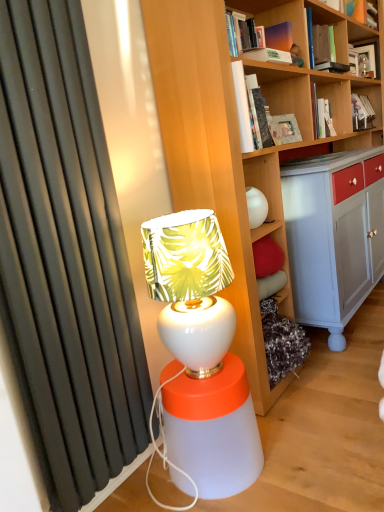
Question: From the image's perspective, is matte orange book at upper right, which ranks as the third book in back-to-front order, under white glossy table lamp at center?

Choices:
 (A) yes
 (B) no

Answer: (B)

Question: Is matte orange book at upper right, acting as the 6th book starting from the bottom, shorter than white glossy table lamp at center?

Choices:
 (A) yes
 (B) no

Answer: (A)

Question: Is matte orange book at upper right, the first book positioned from the top, further to the viewer compared to white glossy table lamp at center?

Choices:
 (A) no
 (B) yes

Answer: (B)

Question: Does matte orange book at upper right, which ranks as the third book in back-to-front order, have a smaller size compared to white glossy table lamp at center?

Choices:
 (A) yes
 (B) no

Answer: (A)

Question: Is matte orange book at upper right, arranged as the fourth book when viewed from the front, turned away from white glossy table lamp at center?

Choices:
 (A) no
 (B) yes

Answer: (A)

Question: From the image's perspective, is matte orange book at upper right, acting as the 6th book starting from the bottom, positioned above or below matte black frame at upper right, positioned as the fifth book in bottom-to-top order?

Choices:
 (A) below
 (B) above

Answer: (B)

Question: Choose the correct answer: Is matte orange book at upper right, which ranks as the third book in back-to-front order, inside matte black frame at upper right, marked as the 1th book in a back-to-front arrangement, or outside it?

Choices:
 (A) inside
 (B) outside

Answer: (B)

Question: Would you say matte orange book at upper right, arranged as the fourth book when viewed from the front, is to the left or to the right of matte black frame at upper right, marked as the 1th book in a back-to-front arrangement, in the picture?

Choices:
 (A) left
 (B) right

Answer: (A)

Question: Based on their sizes in the image, would you say matte orange book at upper right, acting as the 6th book starting from the bottom, is bigger or smaller than matte black frame at upper right, arranged as the second book when viewed from the top?

Choices:
 (A) small
 (B) big

Answer: (A)

Question: Would you say matte black frame at upper right, marked as the 1th book in a back-to-front arrangement, is to the left or to the right of matte orange book at upper right, which ranks as the third book in back-to-front order, in the picture?

Choices:
 (A) right
 (B) left

Answer: (A)

Question: Is point (357, 68) closer or farther from the camera than point (364, 12)?

Choices:
 (A) farther
 (B) closer

Answer: (A)

Question: Considering the positions of matte black frame at upper right, marked as the 1th book in a back-to-front arrangement, and matte orange book at upper right, acting as the 6th book starting from the bottom, in the image, is matte black frame at upper right, marked as the 1th book in a back-to-front arrangement, bigger or smaller than matte orange book at upper right, acting as the 6th book starting from the bottom,?

Choices:
 (A) big
 (B) small

Answer: (A)

Question: From a real-world perspective, is matte black frame at upper right, which is counted as the 6th book, starting from the front, physically located above or below matte orange book at upper right, acting as the 6th book starting from the bottom?

Choices:
 (A) above
 (B) below

Answer: (B)

Question: From the image's perspective, relative to white glossy table lamp at center, is matte orange book at upper right, acting as the 6th book starting from the bottom, above or below?

Choices:
 (A) below
 (B) above

Answer: (B)

Question: Is matte orange book at upper right, the first book positioned from the top, situated inside white glossy table lamp at center or outside?

Choices:
 (A) inside
 (B) outside

Answer: (B)